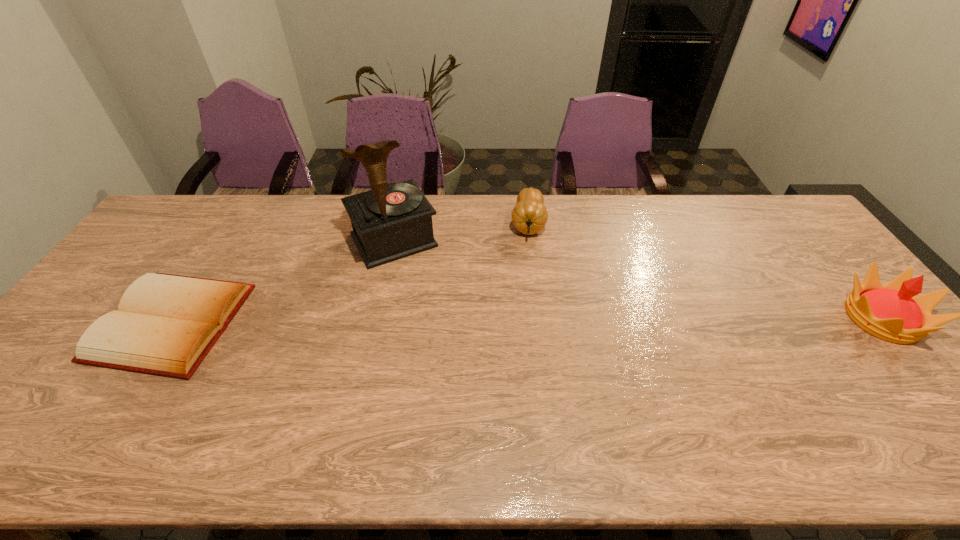
The width and height of the screenshot is (960, 540). In the image, there is a desktop. What are the coordinates of `free space at the far edge` in the screenshot? It's located at (575, 195).

Locate an element on the screen. free space at the near edge is located at coordinates (538, 407).

Image resolution: width=960 pixels, height=540 pixels. In order to click on vacant position at the right edge of the desktop in this screenshot , I will do `click(819, 256)`.

Image resolution: width=960 pixels, height=540 pixels. I want to click on free area in between the rightmost object and the leftmost object, so click(x=527, y=320).

At what (x,y) coordinates should I click in order to perform the action: click on free area in between the second object from right to left and the crown. Please return your answer as a coordinate pair (x, y). Looking at the image, I should click on (705, 271).

Where is `vacant point located between the Bible and the third tallest object`? The image size is (960, 540). vacant point located between the Bible and the third tallest object is located at coordinates (349, 273).

Where is `vacant area that lies between the third shortest object and the gourd`? This screenshot has width=960, height=540. vacant area that lies between the third shortest object and the gourd is located at coordinates pyautogui.click(x=705, y=271).

At what (x,y) coordinates should I click in order to perform the action: click on blank region between the third tallest object and the Bible. Please return your answer as a coordinate pair (x, y). Image resolution: width=960 pixels, height=540 pixels. Looking at the image, I should click on (349, 273).

Locate an element on the screen. The image size is (960, 540). empty location between the leftmost object and the gourd is located at coordinates (349, 273).

I want to click on free point between the leftmost object and the third object from left to right, so click(x=349, y=273).